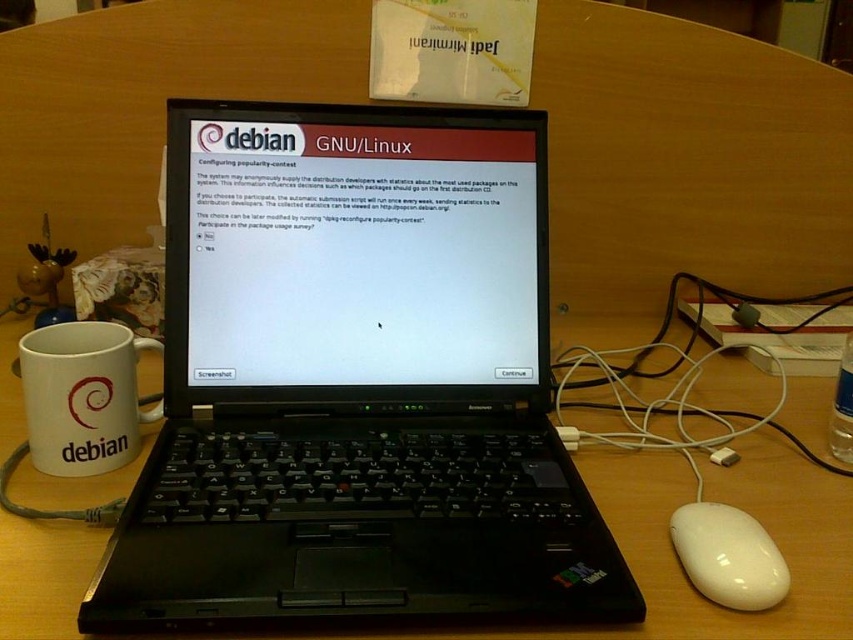
Question: Is black plastic laptop at center bigger than white glossy mouse at lower right?

Choices:
 (A) no
 (B) yes

Answer: (B)

Question: Can you confirm if black plastic laptop at center is smaller than matte black monitor at center?

Choices:
 (A) no
 (B) yes

Answer: (A)

Question: Which of the following is the closest to the observer?

Choices:
 (A) white glossy mouse at lower right
 (B) wooden table at center
 (C) white matte mug at left

Answer: (B)

Question: Does wooden table at center appear over white glossy mouse at lower right?

Choices:
 (A) no
 (B) yes

Answer: (B)

Question: Which point appears closest to the camera in this image?

Choices:
 (A) (32, 436)
 (B) (746, 602)
 (C) (526, 595)
 (D) (193, 109)

Answer: (C)

Question: Among these points, which one is nearest to the camera?

Choices:
 (A) (802, 634)
 (B) (416, 579)
 (C) (45, 355)
 (D) (546, 234)

Answer: (A)